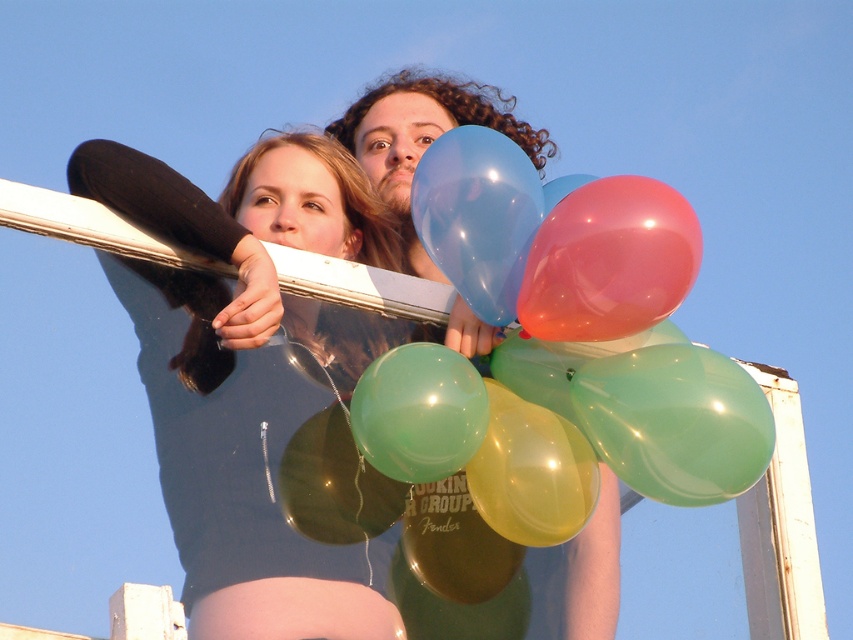
Question: Can you confirm if smooth black hair at upper center is thinner than translucent glossy balloon at upper center?

Choices:
 (A) yes
 (B) no

Answer: (B)

Question: Which point is farther from the camera taking this photo?

Choices:
 (A) (160, 467)
 (B) (224, 212)

Answer: (B)

Question: Which object is positioned farthest from the smooth black hair at upper center?

Choices:
 (A) translucent glossy balloons at upper center
 (B) matte black hoodie at upper left
 (C) translucent glossy balloon at upper center

Answer: (C)

Question: Which of the following is the farthest from the observer?

Choices:
 (A) (352, 188)
 (B) (534, 256)
 (C) (329, 365)

Answer: (A)

Question: Does translucent glossy balloons at upper center appear on the right side of smooth black hair at upper center?

Choices:
 (A) no
 (B) yes

Answer: (B)

Question: Is translucent glossy balloons at upper center above matte black hoodie at upper left?

Choices:
 (A) no
 (B) yes

Answer: (A)